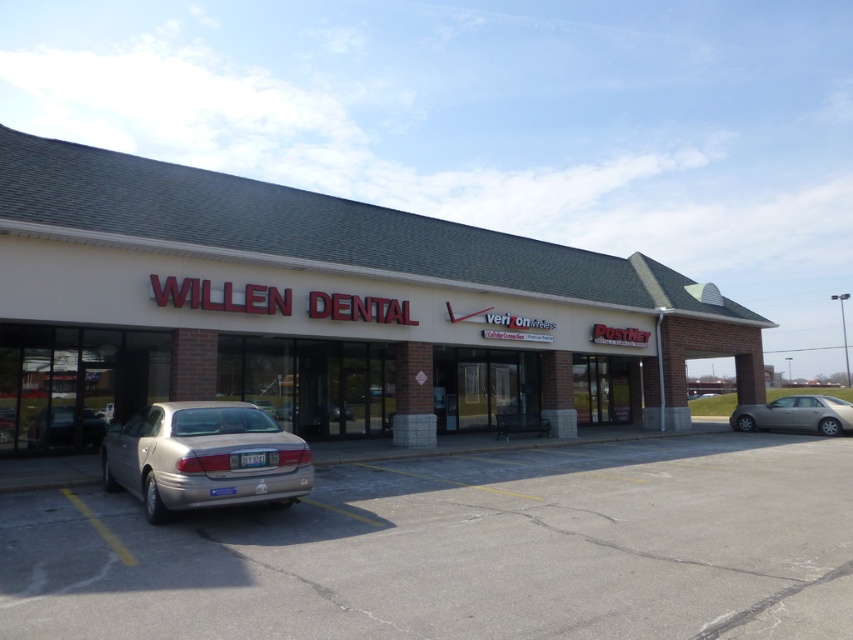
Can you confirm if silver metallic car at lower left is smaller than silver metallic sedan at lower left?

No.

Describe the element at coordinates (463, 548) in the screenshot. The width and height of the screenshot is (853, 640). I see `silver metallic car at lower left` at that location.

This screenshot has width=853, height=640. I want to click on silver metallic car at lower left, so click(x=463, y=548).

Which is below, silver metallic sedan at right or silver metallic sedan at lower left?

silver metallic sedan at right is lower down.

Which is above, silver metallic sedan at right or silver metallic sedan at lower left?

silver metallic sedan at lower left is higher up.

Is point (798, 403) closer to camera compared to point (67, 412)?

No, it is behind (67, 412).

At what (x,y) coordinates should I click in order to perform the action: click on silver metallic sedan at right. Please return your answer as a coordinate pair (x, y). Looking at the image, I should click on (796, 413).

Is white brick building at center below satin gold sedan at lower left?

No.

Who is lower down, white brick building at center or satin gold sedan at lower left?

satin gold sedan at lower left is lower down.

Does point (62, 356) lie behind point (201, 403)?

Yes, it is.

Identify the location of white brick building at center. The image size is (853, 640). (322, 307).